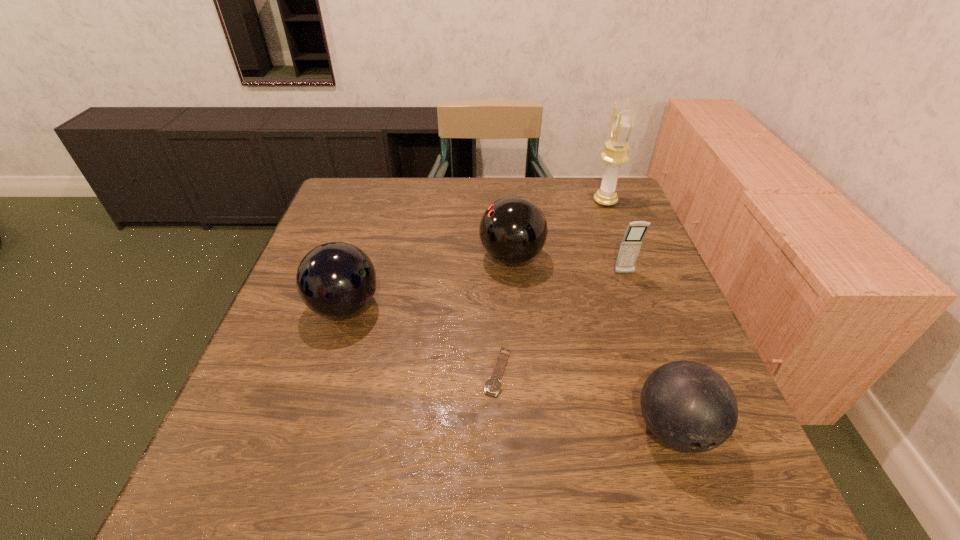
Image resolution: width=960 pixels, height=540 pixels. I want to click on object that is at the left edge, so click(335, 279).

You are a GUI agent. You are given a task and a screenshot of the screen. Output one action in this format:
    pyautogui.click(x=<x>, y=<y>)
    Task: Click on the award located in the right edge section of the desktop
    The height and width of the screenshot is (540, 960).
    Given the screenshot: What is the action you would take?
    pyautogui.click(x=622, y=121)

Find the location of a particular element. The width and height of the screenshot is (960, 540). cellular telephone that is at the right edge is located at coordinates (630, 246).

Image resolution: width=960 pixels, height=540 pixels. I want to click on bowling ball that is at the right edge, so click(x=688, y=406).

At what (x,y) coordinates should I click in order to perform the action: click on object that is positioned at the far right corner. Please return your answer as a coordinate pair (x, y). This screenshot has height=540, width=960. Looking at the image, I should click on (622, 121).

You are a GUI agent. You are given a task and a screenshot of the screen. Output one action in this format:
    pyautogui.click(x=<x>, y=<y>)
    Task: Click on the object that is at the near right corner
    The height and width of the screenshot is (540, 960).
    Given the screenshot: What is the action you would take?
    pyautogui.click(x=688, y=406)

Locate an element on the screen. Image resolution: width=960 pixels, height=540 pixels. blank space at the far edge is located at coordinates (524, 191).

I want to click on vacant space at the left edge of the desktop, so click(337, 224).

At what (x,y) coordinates should I click in order to perform the action: click on vacant position at the right edge of the desktop. Please return your answer as a coordinate pair (x, y). Looking at the image, I should click on (610, 260).

The height and width of the screenshot is (540, 960). Find the location of `free spot at the far left corner of the desktop`. free spot at the far left corner of the desktop is located at coordinates (356, 201).